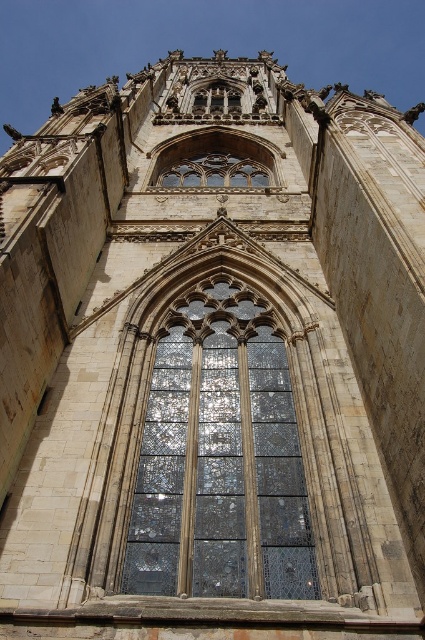
Does stained glass window at center have a smaller size compared to stained glass window at upper center?

Correct, stained glass window at center occupies less space than stained glass window at upper center.

Who is shorter, stained glass window at center or stained glass window at upper center?

Standing shorter between the two is stained glass window at upper center.

Image resolution: width=425 pixels, height=640 pixels. Find the location of `stained glass window at center`. stained glass window at center is located at coordinates (221, 461).